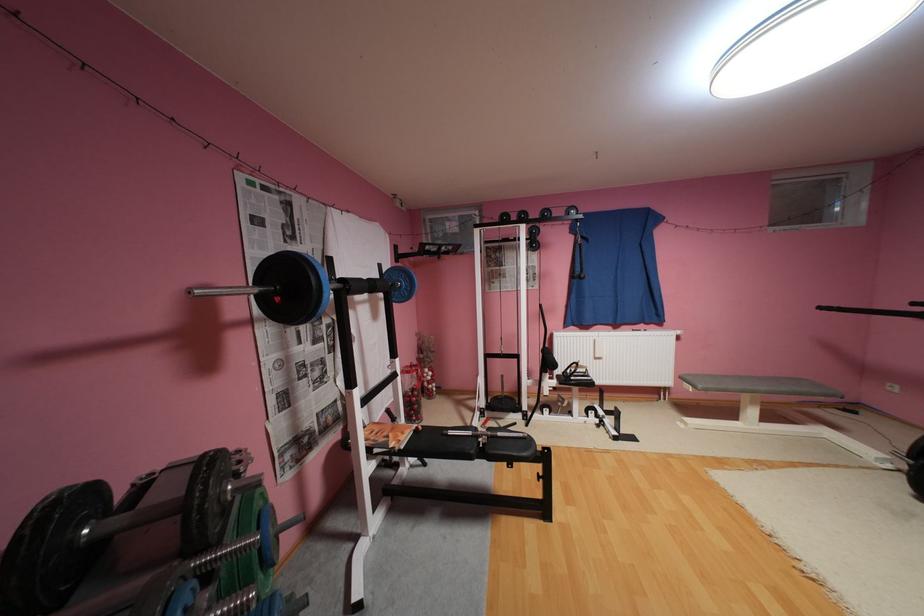
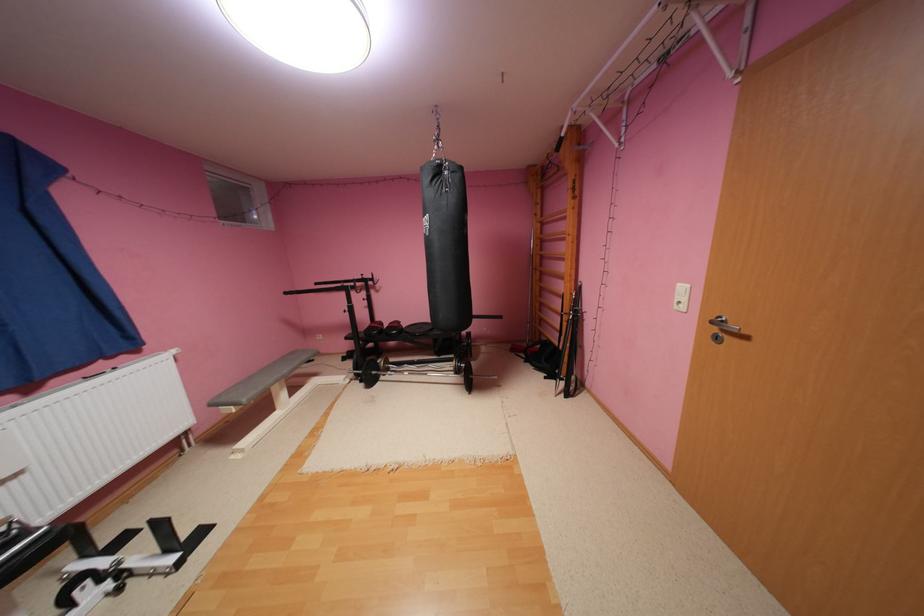
Question: The images are taken continuously from a first-person perspective. In which direction is your viewpoint rotating?

Choices:
 (A) Left
 (B) Right
 (C) Up
 (D) Down

Answer: (B)